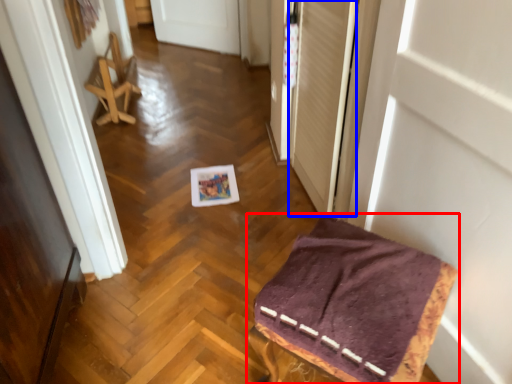
Question: Which object appears farthest to the camera in this image, furniture (highlighted by a red box) or screen door (highlighted by a blue box)?

Choices:
 (A) furniture
 (B) screen door

Answer: (B)